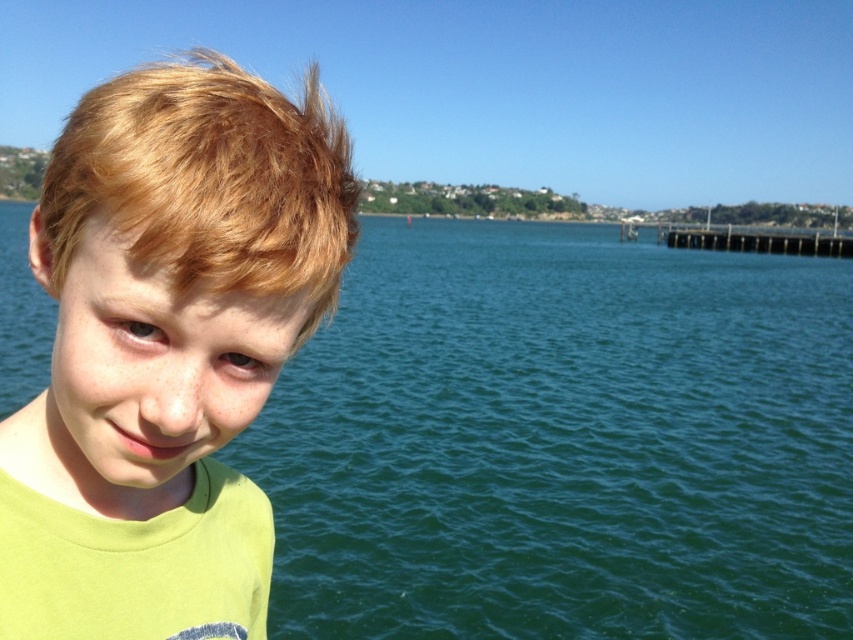
Between blonde hair at left and wooden pier at right, which one is positioned lower?

wooden pier at right is below.

Who is positioned more to the right, blonde hair at left or wooden pier at right?

From the viewer's perspective, wooden pier at right appears more on the right side.

Describe the element at coordinates (207, 182) in the screenshot. I see `blonde hair at left` at that location.

Where is `blonde hair at left`? Image resolution: width=853 pixels, height=640 pixels. blonde hair at left is located at coordinates (207, 182).

Can you confirm if green water at left is positioned below blonde hair at left?

Indeed, green water at left is positioned under blonde hair at left.

Is point (392, 449) positioned behind point (190, 161)?

Yes, it is behind point (190, 161).

Does point (685, 410) come farther from viewer compared to point (293, 106)?

That is True.

Where is `green water at left`? green water at left is located at coordinates (561, 442).

Between green water at left and light green t-shirt at left, which one has more height?

Standing taller between the two is green water at left.

Between green water at left and light green t-shirt at left, which one appears on the right side from the viewer's perspective?

From the viewer's perspective, green water at left appears more on the right side.

The width and height of the screenshot is (853, 640). Find the location of `green water at left`. green water at left is located at coordinates (561, 442).